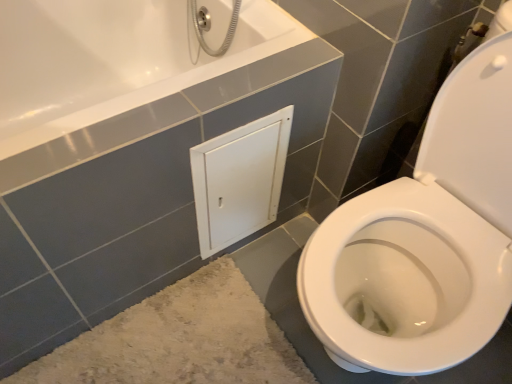
Question: From a real-world perspective, relative to beige shaggy bath mat at lower left, is white matte cabinet at center vertically above or below?

Choices:
 (A) below
 (B) above

Answer: (B)

Question: Does point (266, 124) appear closer or farther from the camera than point (244, 370)?

Choices:
 (A) farther
 (B) closer

Answer: (B)

Question: Considering the positions of white matte cabinet at center and beige shaggy bath mat at lower left in the image, is white matte cabinet at center wider or thinner than beige shaggy bath mat at lower left?

Choices:
 (A) thin
 (B) wide

Answer: (A)

Question: Considering the positions of beige shaggy bath mat at lower left and white matte cabinet at center in the image, is beige shaggy bath mat at lower left wider or thinner than white matte cabinet at center?

Choices:
 (A) thin
 (B) wide

Answer: (B)

Question: Visually, is beige shaggy bath mat at lower left positioned to the left or to the right of white matte cabinet at center?

Choices:
 (A) right
 (B) left

Answer: (B)

Question: In terms of size, does beige shaggy bath mat at lower left appear bigger or smaller than white matte cabinet at center?

Choices:
 (A) big
 (B) small

Answer: (A)

Question: From a real-world perspective, is beige shaggy bath mat at lower left positioned above or below white matte cabinet at center?

Choices:
 (A) below
 (B) above

Answer: (A)